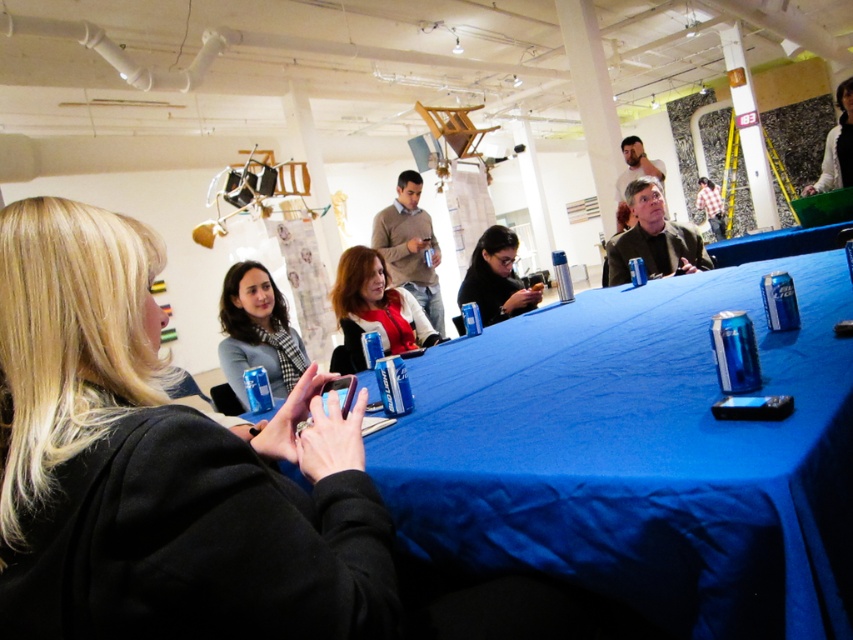
Question: Which of the following is the farthest from the observer?

Choices:
 (A) (834, 177)
 (B) (849, 397)
 (C) (480, 289)
 (D) (28, 342)

Answer: (A)

Question: Which point is farther from the camera taking this photo?

Choices:
 (A) (457, 301)
 (B) (410, 344)
 (C) (836, 628)
 (D) (297, 486)

Answer: (A)

Question: Does matte gray scarf at center appear on the right side of matte black jacket at center?

Choices:
 (A) yes
 (B) no

Answer: (B)

Question: From the image, what is the correct spatial relationship of matte black jacket at center in relation to white fabric jacket at upper right?

Choices:
 (A) above
 (B) below

Answer: (B)

Question: Can you confirm if matte gray scarf at center is bigger than matte black jacket at center?

Choices:
 (A) yes
 (B) no

Answer: (B)

Question: Which object appears farthest from the camera in this image?

Choices:
 (A) matte black jacket at center
 (B) matte gray scarf at center
 (C) matte black phone at center

Answer: (C)